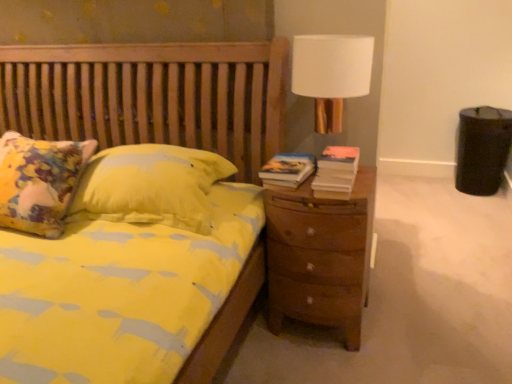
Question: Considering the relative positions of brown wooden nightstand at right and hardcover book at right, the 1th book positioned from the left, in the image provided, is brown wooden nightstand at right to the left of hardcover book at right, the 1th book positioned from the left, from the viewer's perspective?

Choices:
 (A) no
 (B) yes

Answer: (A)

Question: Is brown wooden nightstand at right thinner than hardcover book at right, the 1th book positioned from the left?

Choices:
 (A) no
 (B) yes

Answer: (A)

Question: Is brown wooden nightstand at right positioned beyond the bounds of hardcover book at right, the 1th book positioned from the left?

Choices:
 (A) no
 (B) yes

Answer: (B)

Question: Is brown wooden nightstand at right taller than hardcover book at right, the 1th book positioned from the left?

Choices:
 (A) no
 (B) yes

Answer: (B)

Question: Does brown wooden nightstand at right have a lesser height compared to hardcover book at right, which is the 2th book in right-to-left order?

Choices:
 (A) yes
 (B) no

Answer: (B)

Question: From a real-world perspective, is hardcover book at right, the 1th book positioned from the left, above or below white fabric lampshade at upper right?

Choices:
 (A) below
 (B) above

Answer: (A)

Question: From the image's perspective, is hardcover book at right, which is the 2th book in right-to-left order, above or below white fabric lampshade at upper right?

Choices:
 (A) below
 (B) above

Answer: (A)

Question: Is hardcover book at right, which is the 2th book in right-to-left order, in front of or behind white fabric lampshade at upper right in the image?

Choices:
 (A) front
 (B) behind

Answer: (B)

Question: Considering the positions of point (275, 155) and point (307, 51), is point (275, 155) closer or farther from the camera than point (307, 51)?

Choices:
 (A) closer
 (B) farther

Answer: (B)

Question: Looking at their shapes, would you say brown wooden nightstand at right is wider or thinner than hardcover book at right, the first book positioned from the right?

Choices:
 (A) thin
 (B) wide

Answer: (B)

Question: Considering the positions of point (309, 322) and point (325, 157), is point (309, 322) closer or farther from the camera than point (325, 157)?

Choices:
 (A) farther
 (B) closer

Answer: (A)

Question: Is brown wooden nightstand at right spatially inside hardcover book at right, which appears as the second book when viewed from the left, or outside of it?

Choices:
 (A) inside
 (B) outside

Answer: (B)

Question: Is brown wooden nightstand at right taller or shorter than hardcover book at right, which appears as the second book when viewed from the left?

Choices:
 (A) tall
 (B) short

Answer: (A)

Question: Is point (362, 240) positioned closer to the camera than point (293, 160)?

Choices:
 (A) farther
 (B) closer

Answer: (B)

Question: Is brown wooden nightstand at right inside the boundaries of hardcover book at right, the 1th book positioned from the left, or outside?

Choices:
 (A) outside
 (B) inside

Answer: (A)